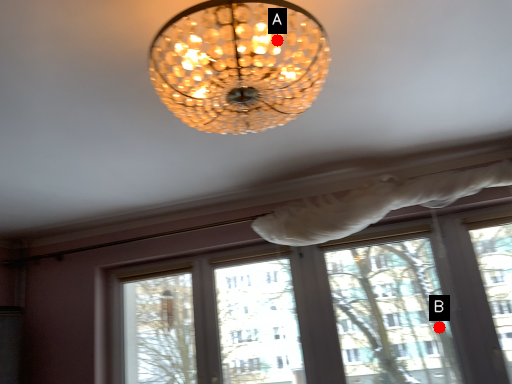
Question: Two points are circled on the image, labeled by A and B beside each circle. Which point is farther from the camera taking this photo?

Choices:
 (A) A is further
 (B) B is further

Answer: (B)